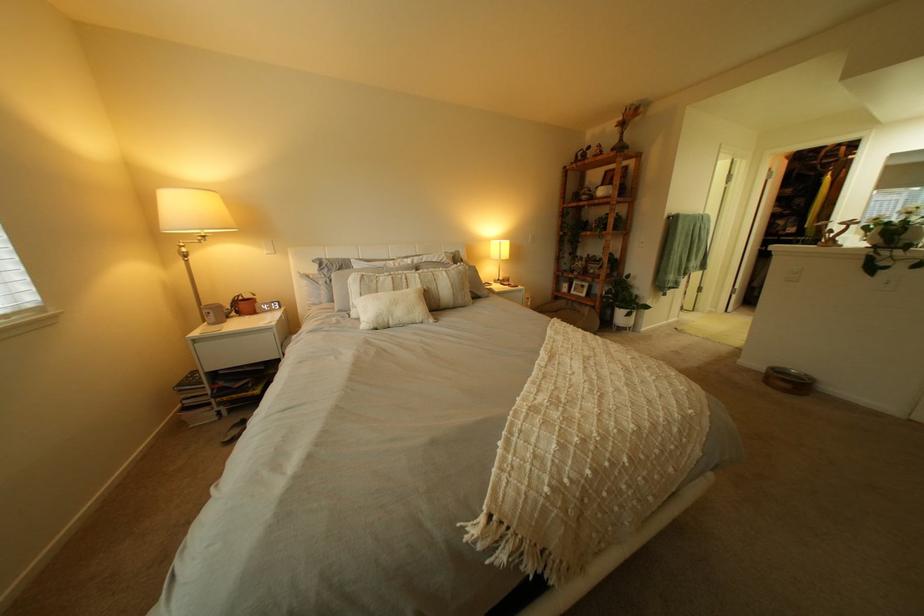
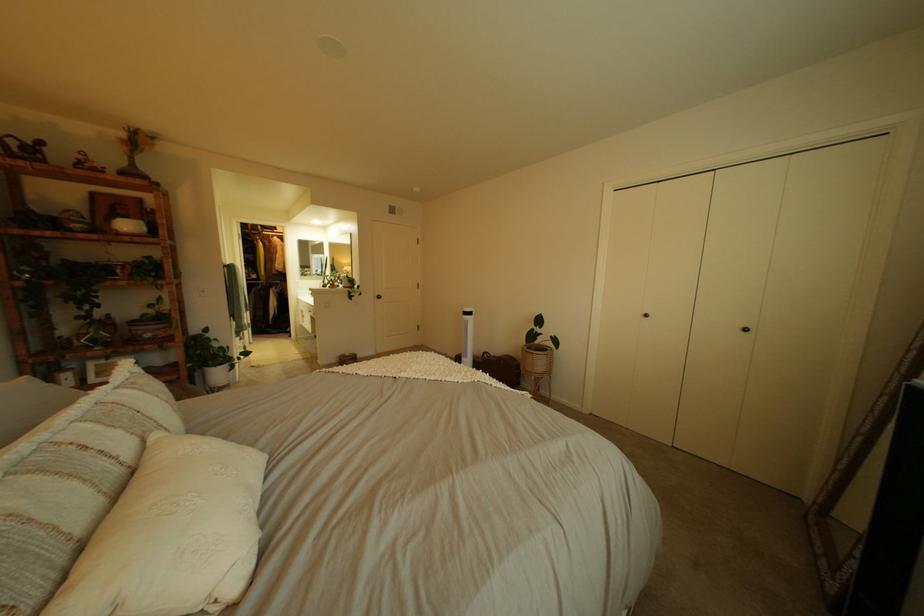
In the second image, find the point that corresponds to (x=859, y=150) in the first image.

(274, 228)